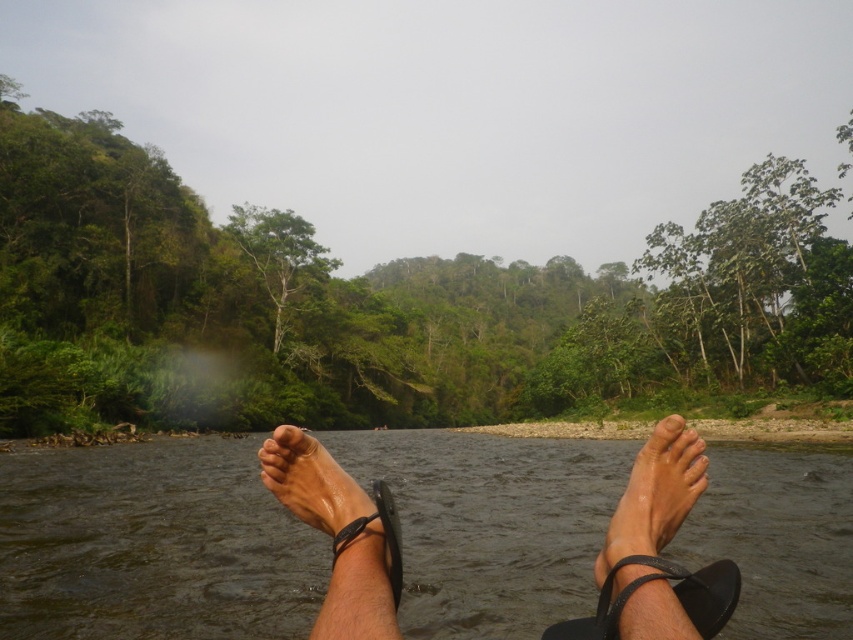
You are standing at the edge of the river and see two points marked in the scene. Which point is closer to you, point (x=82, y=609) or point (x=601, y=616)?

Point (x=82, y=609) is closer to you because it is further to the viewer than point (x=601, y=616).

You are standing at the origin point of the image coordinate system and want to place a new object at the location of the black leather sandal at lower center. What are the coordinates where you should place the new object?

The coordinates for placing the new object should be at point (672, 592), as the black leather sandal at lower center is located there.